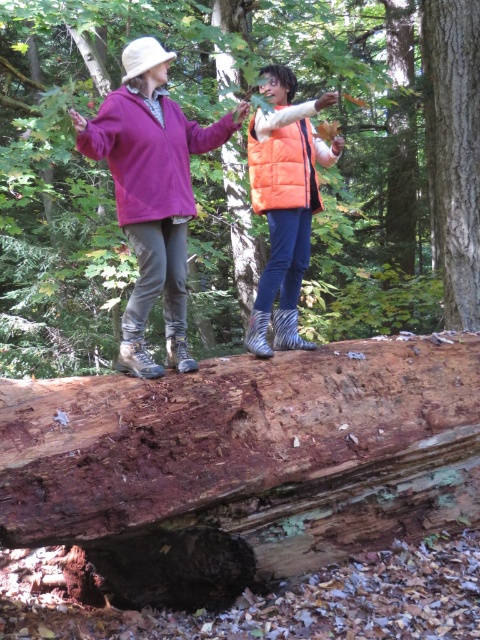
Question: Is smooth bark tree trunk at center to the right of orange puffy vest at center from the viewer's perspective?

Choices:
 (A) yes
 (B) no

Answer: (A)

Question: Among these points, which one is farthest from the camera?

Choices:
 (A) (477, 179)
 (B) (276, 321)
 (C) (147, 188)

Answer: (A)

Question: Among these objects, which one is farthest from the camera?

Choices:
 (A) orange quilted vest at center
 (B) matte purple fleece at upper left
 (C) matte purple fleece jacket at center

Answer: (A)

Question: Where is matte purple fleece at upper left located in relation to orange puffy vest at center in the image?

Choices:
 (A) right
 (B) left

Answer: (B)

Question: Can you confirm if matte purple fleece jacket at center is bigger than rough bark tree trunk at center?

Choices:
 (A) no
 (B) yes

Answer: (A)

Question: Which object appears farthest from the camera in this image?

Choices:
 (A) matte purple fleece jacket at center
 (B) orange quilted vest at center
 (C) rough bark tree trunk at center
 (D) orange puffy vest at center

Answer: (C)